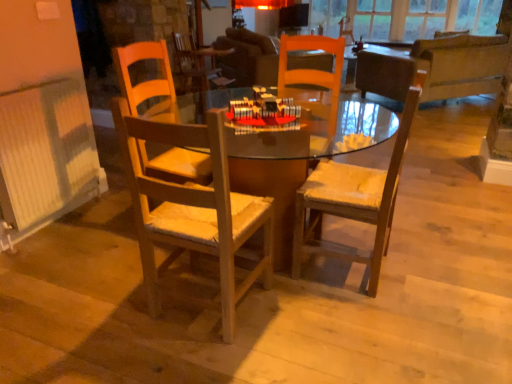
You are a GUI agent. You are given a task and a screenshot of the screen. Output one action in this format:
    pyautogui.click(x=<x>, y=<y>)
    Task: Click on the vacant space to the right of wooden table at center
    The height and width of the screenshot is (384, 512).
    Given the screenshot: What is the action you would take?
    pyautogui.click(x=440, y=246)